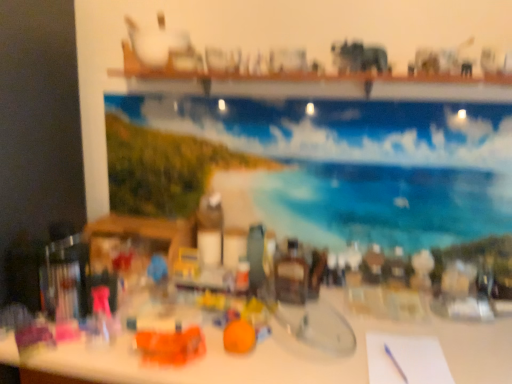
You are a GUI agent. You are given a task and a screenshot of the screen. Output one action in this format:
    pyautogui.click(x=<x>, y=<y>)
    Task: Click on the unoccupied area behind white paper at lower right
    Image resolution: width=512 pixels, height=384 pixels.
    Given the screenshot: What is the action you would take?
    [x=379, y=326]